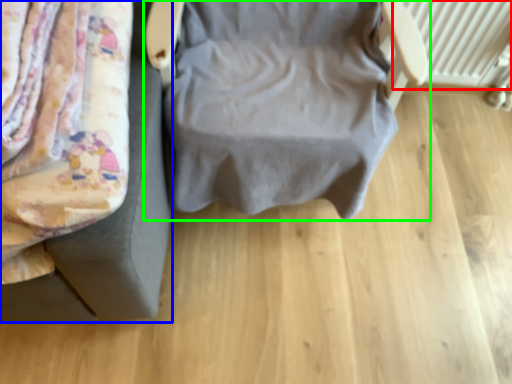
Question: Which object is positioned closest to radiator (highlighted by a red box)? Select from furniture (highlighted by a blue box) and furniture (highlighted by a green box).

Choices:
 (A) furniture
 (B) furniture

Answer: (B)